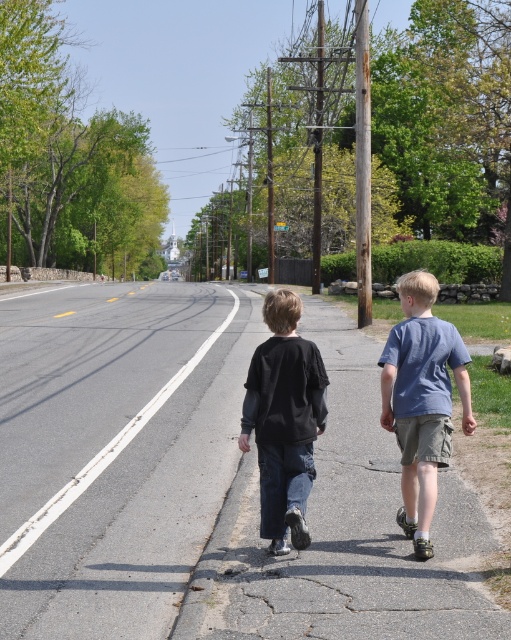
Question: Is blue cotton shirt at right smaller than black matte pants at center?

Choices:
 (A) no
 (B) yes

Answer: (B)

Question: Which of the following is the closest to the observer?

Choices:
 (A) gray asphalt road at center
 (B) blue cotton shirt at right
 (C) black matte pants at center

Answer: (A)

Question: Is gray asphalt road at center bigger than black matte pants at center?

Choices:
 (A) yes
 (B) no

Answer: (A)

Question: Among these objects, which one is farthest from the camera?

Choices:
 (A) gray asphalt road at center
 (B) blue cotton shirt at right

Answer: (B)

Question: Does gray asphalt road at center have a lesser width compared to blue cotton shirt at right?

Choices:
 (A) no
 (B) yes

Answer: (A)

Question: Among these points, which one is nearest to the camera?

Choices:
 (A) (245, 403)
 (B) (435, 348)
 (C) (220, 500)

Answer: (A)